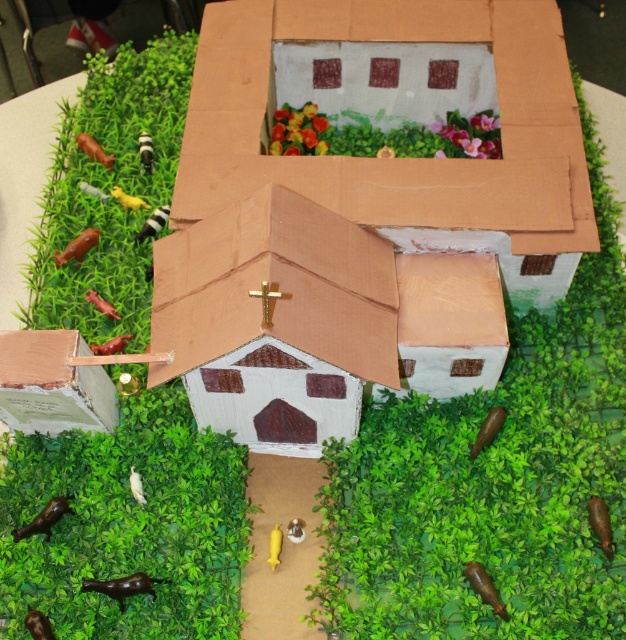
Question: Can you confirm if brown matte horse at lower left is positioned below brown matte cow at lower left?

Choices:
 (A) yes
 (B) no

Answer: (A)

Question: Which point is closer to the camera taking this photo?

Choices:
 (A) (419, 106)
 (B) (145, 589)

Answer: (B)

Question: Is brown matte horse at lower left bigger than brown matte cow at lower left?

Choices:
 (A) no
 (B) yes

Answer: (B)

Question: Is matte cardboard church at center above brown matte cow at lower left?

Choices:
 (A) no
 (B) yes

Answer: (B)

Question: Which is nearer to the brown matte cow at lower left?

Choices:
 (A) matte cardboard church at center
 (B) brown matte horse at lower left

Answer: (B)

Question: Which object is positioned farthest from the brown matte cow at lower left?

Choices:
 (A) matte cardboard church at center
 (B) brown matte horse at lower left

Answer: (A)